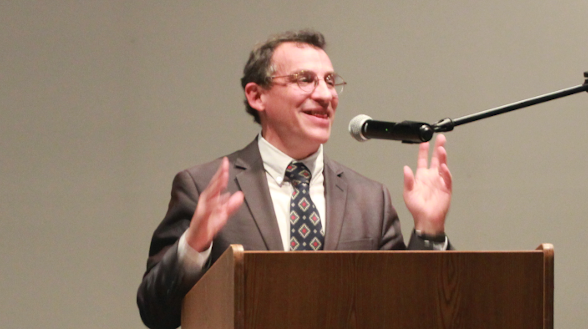
This screenshot has width=588, height=329. Find the location of `wooden lecturn`. wooden lecturn is located at coordinates (348, 273).